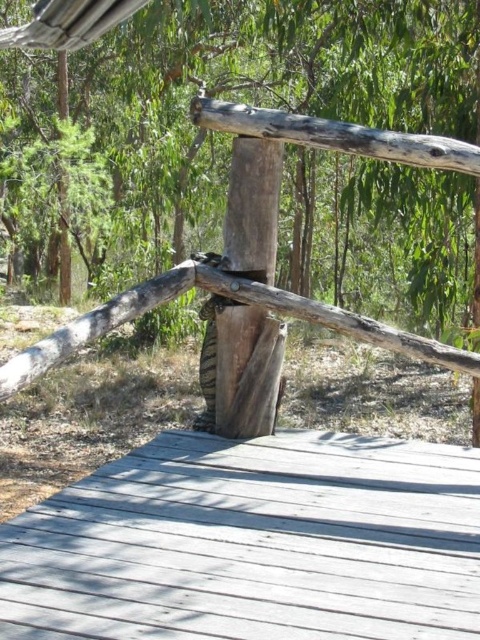
Is smooth gray wood deck at center below weathered wood post at center?

Yes, smooth gray wood deck at center is below weathered wood post at center.

Which is more to the right, smooth gray wood deck at center or weathered wood post at center?

weathered wood post at center

In order to click on smooth gray wood deck at center in this screenshot , I will do `click(252, 544)`.

What are the coordinates of `smooth gray wood deck at center` in the screenshot? It's located at (252, 544).